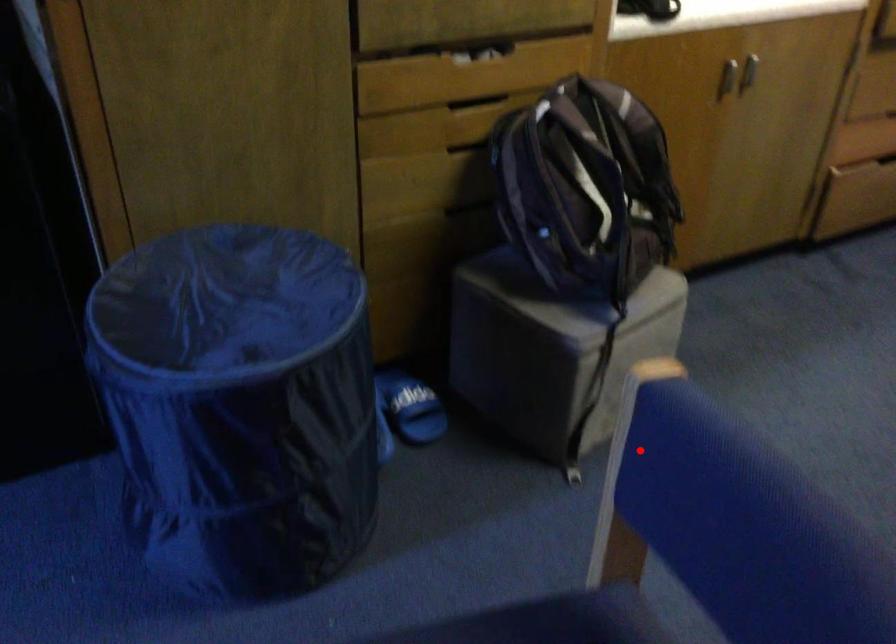
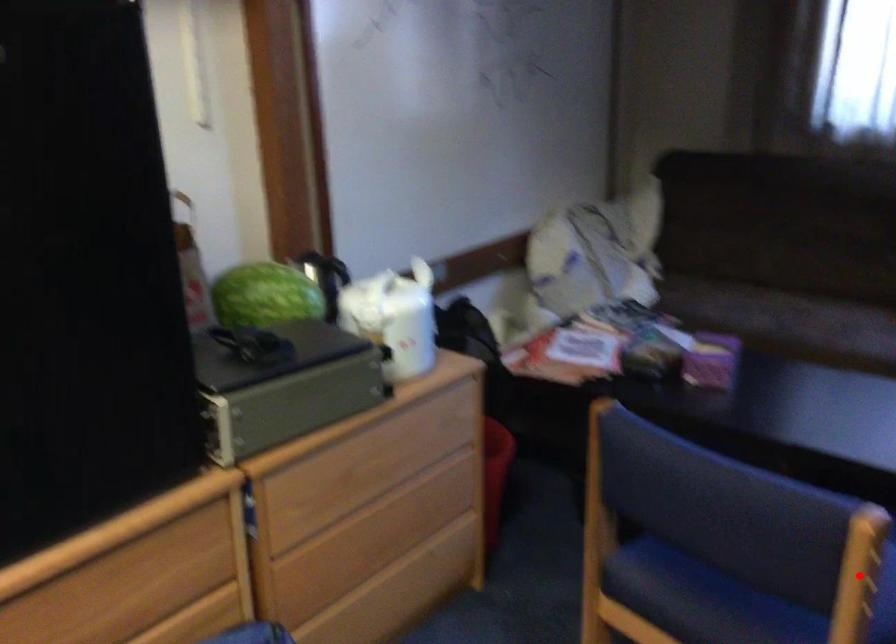
I am providing you with two images of the same scene from different viewpoints. A red point is marked on the first image and another point is marked on the second image. Is the red point in image1 aligned with the point shown in image2?

Yes